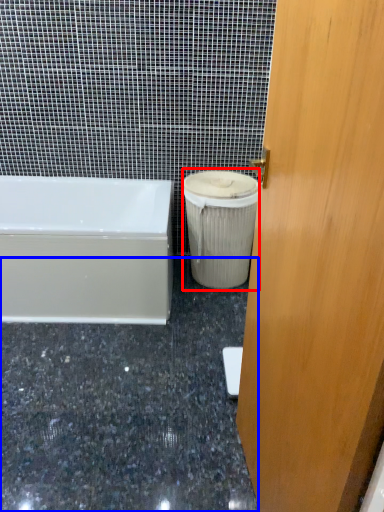
Question: Among these objects, which one is nearest to the camera, garbage (highlighted by a red box) or granite (highlighted by a blue box)?

Choices:
 (A) garbage
 (B) granite

Answer: (B)